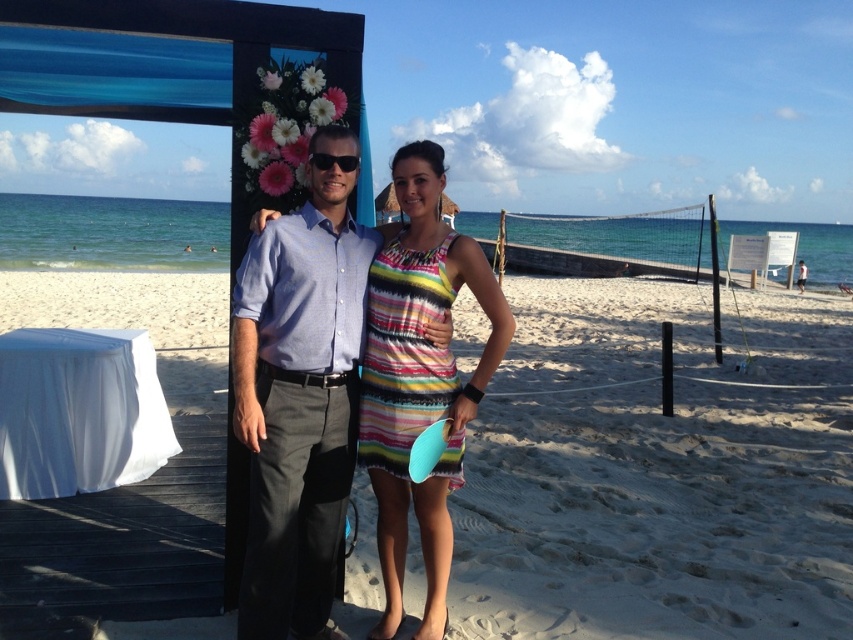
Is white sand at center taller than light blue shirt at center?

Yes.

Can you confirm if white sand at center is positioned to the right of light blue shirt at center?

Incorrect, white sand at center is not on the right side of light blue shirt at center.

Which is behind, point (695, 570) or point (306, 273)?

Point (695, 570)

Where is `white sand at center`? white sand at center is located at coordinates (659, 472).

Does light blue shirt at center appear over striped fabric dress at center?

Incorrect, light blue shirt at center is not positioned above striped fabric dress at center.

Which is in front, point (286, 497) or point (422, 378)?

Positioned in front is point (286, 497).

Is point (346, 273) less distant than point (374, 420)?

Yes.

Where is `light blue shirt at center`? The image size is (853, 640). light blue shirt at center is located at coordinates (300, 394).

Who is higher up, white sand at center or striped fabric dress at center?

white sand at center is above.

Find the location of a particular element. The height and width of the screenshot is (640, 853). white sand at center is located at coordinates (659, 472).